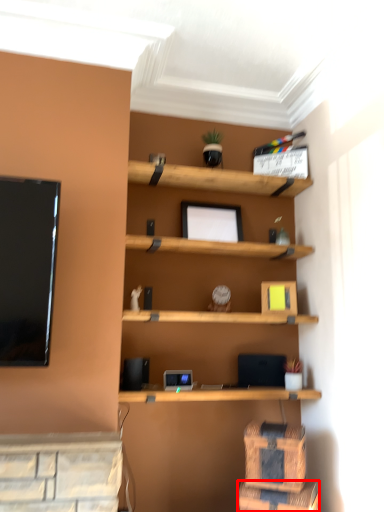
Question: In this image, where is drawer (annotated by the red box) located relative to drawer?

Choices:
 (A) left
 (B) right

Answer: (B)